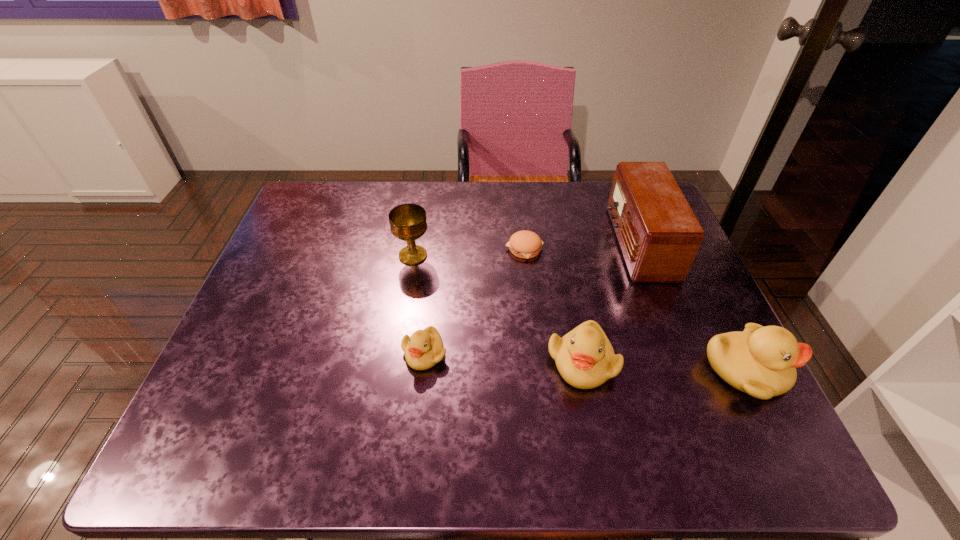
You are a GUI agent. You are given a task and a screenshot of the screen. Output one action in this format:
    pyautogui.click(x=<x>, y=<y>)
    Task: Click on the shortest duckling
    The image size is (960, 540).
    Given the screenshot: What is the action you would take?
    pyautogui.click(x=423, y=349)

Identify the location of the leftmost duckling. This screenshot has width=960, height=540. click(423, 349).

This screenshot has height=540, width=960. Find the location of `the fourth tallest object`. the fourth tallest object is located at coordinates (585, 358).

I want to click on the second duckling from right to left, so click(585, 358).

The height and width of the screenshot is (540, 960). I want to click on the rightmost duckling, so click(x=761, y=361).

At what (x,y) coordinates should I click in order to perform the action: click on the tallest object. Please return your answer as a coordinate pair (x, y). Looking at the image, I should click on (659, 235).

At what (x,y) coordinates should I click in order to perform the action: click on chalice. Please return your answer as a coordinate pair (x, y). Looking at the image, I should click on (408, 222).

Where is `the shortest object`? the shortest object is located at coordinates (524, 244).

Where is `vacant space positioned 0.190m on the front-facing side of the radio receiver`? The height and width of the screenshot is (540, 960). vacant space positioned 0.190m on the front-facing side of the radio receiver is located at coordinates (544, 242).

This screenshot has height=540, width=960. I want to click on vacant space situated 0.130m on the front-facing side of the radio receiver, so click(x=565, y=242).